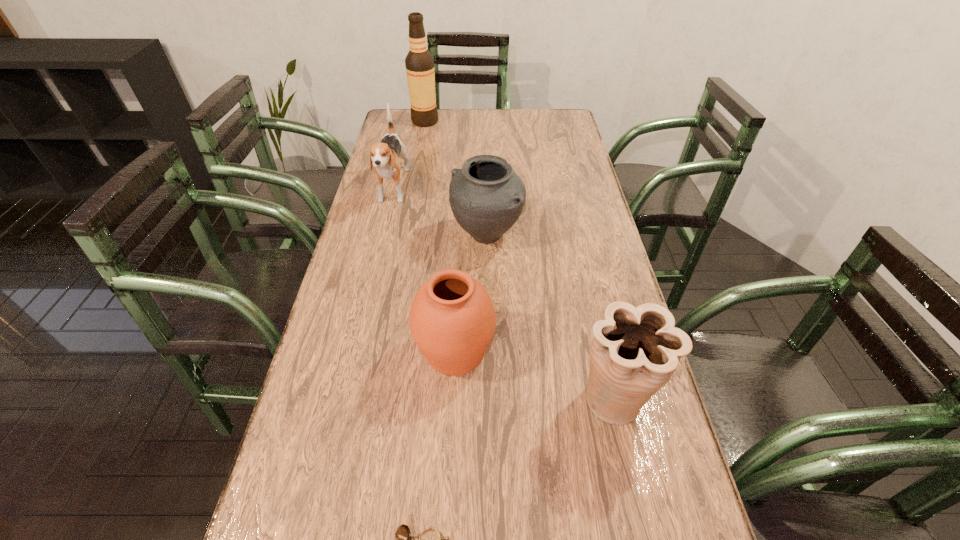
Locate an element on the screen. This screenshot has height=540, width=960. unoccupied position between the farthest urn and the rightmost object is located at coordinates (550, 317).

Identify which object is the third closest to the puppy. Please provide its 2D coordinates. Your answer should be formatted as a tuple, i.e. [(x, y)], where the tuple contains the x and y coordinates of a point satisfying the conditions above.

[(452, 320)]

Identify which object is the third closest to the nearest object. Please provide its 2D coordinates. Your answer should be formatted as a tuple, i.e. [(x, y)], where the tuple contains the x and y coordinates of a point satisfying the conditions above.

[(486, 196)]

This screenshot has height=540, width=960. Find the location of `urn object that ranks as the closest to the puppy`. urn object that ranks as the closest to the puppy is located at coordinates (486, 196).

Point out which urn is positioned as the second nearest to the farthest urn. Please provide its 2D coordinates. Your answer should be formatted as a tuple, i.e. [(x, y)], where the tuple contains the x and y coordinates of a point satisfying the conditions above.

[(635, 350)]

Locate an element on the screen. blank area in the image that satisfies the following two spatial constraints: 1. on the label of the alcohol; 2. on the right side of the farthest urn is located at coordinates (404, 235).

What are the coordinates of `free region that satisfies the following two spatial constraints: 1. at the face of the farthest urn; 2. on the right side of the puppy` in the screenshot? It's located at (383, 235).

The height and width of the screenshot is (540, 960). I want to click on vacant space that satisfies the following two spatial constraints: 1. on the back side of the rightmost urn; 2. on the label of the tallest object, so click(550, 122).

Find the location of a particular element. Image resolution: width=960 pixels, height=540 pixels. free spot that satisfies the following two spatial constraints: 1. at the face of the rightmost urn; 2. on the left side of the puppy is located at coordinates (345, 399).